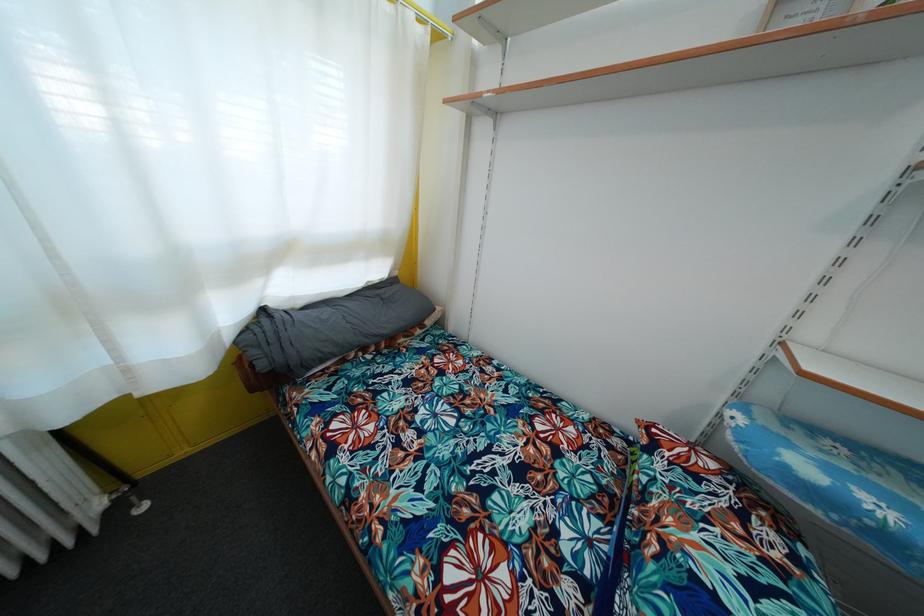
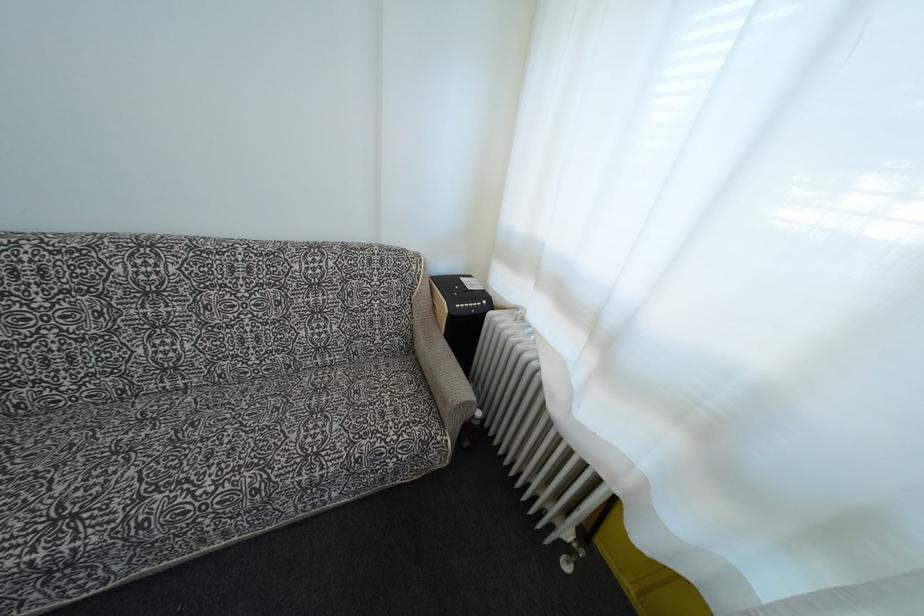
Based on the continuous images, in which direction is the camera rotating?

The rotation direction of the camera is left-down.